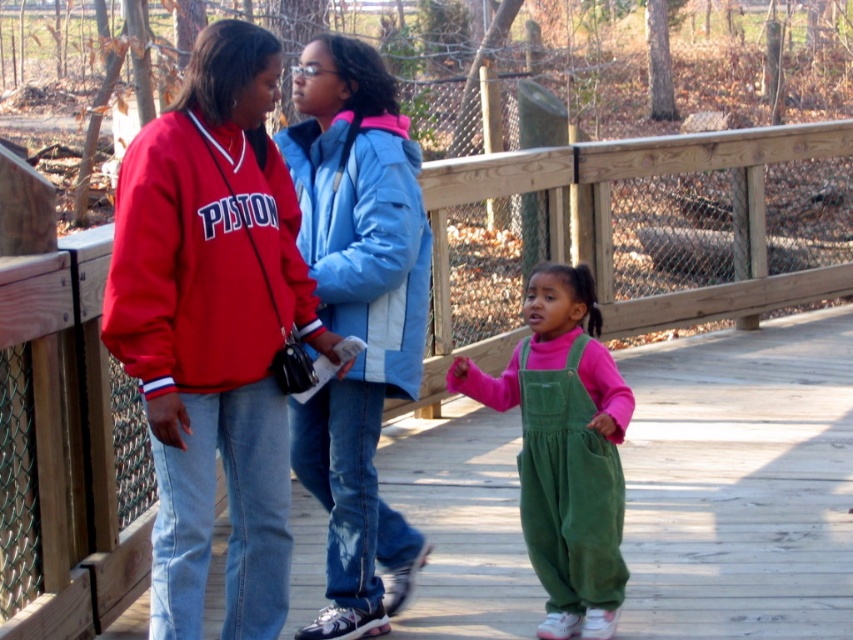
Describe the element at coordinates (202, 260) in the screenshot. This screenshot has height=640, width=853. I see `matte red sweatshirt at left` at that location.

Is point (181, 368) positioned after point (525, 339)?

No, it is in front of (525, 339).

The width and height of the screenshot is (853, 640). Find the location of `matte red sweatshirt at left`. matte red sweatshirt at left is located at coordinates (202, 260).

Locate an element on the screen. Image resolution: width=853 pixels, height=640 pixels. matte red sweatshirt at left is located at coordinates (202, 260).

Who is higher up, light blue jacket at center or matte red sweatshirt at left?

matte red sweatshirt at left is higher up.

Consider the image. Who is lower down, light blue jacket at center or matte red sweatshirt at left?

light blue jacket at center is below.

This screenshot has width=853, height=640. I want to click on light blue jacket at center, so (357, 317).

Where is `light blue jacket at center`? Image resolution: width=853 pixels, height=640 pixels. light blue jacket at center is located at coordinates (357, 317).

Between matte red jacket at center and blue fleece sweatshirt at center, which one has less height?

Standing shorter between the two is blue fleece sweatshirt at center.

Based on the photo, is matte red jacket at center wider than blue fleece sweatshirt at center?

Indeed, matte red jacket at center has a greater width compared to blue fleece sweatshirt at center.

What do you see at coordinates (213, 328) in the screenshot? I see `matte red jacket at center` at bounding box center [213, 328].

Identify the location of matte red jacket at center. (213, 328).